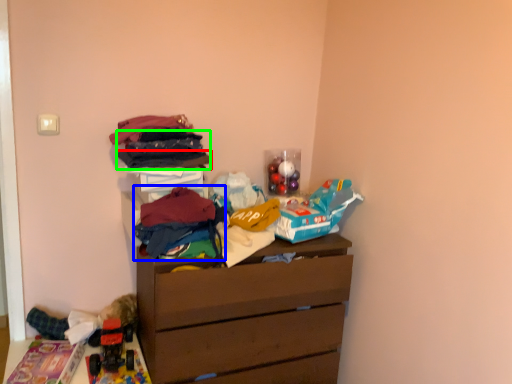
Question: Which is nearer to the clothing (highlighted by a red box)? clothing (highlighted by a blue box) or clothing (highlighted by a green box).

Choices:
 (A) clothing
 (B) clothing

Answer: (B)